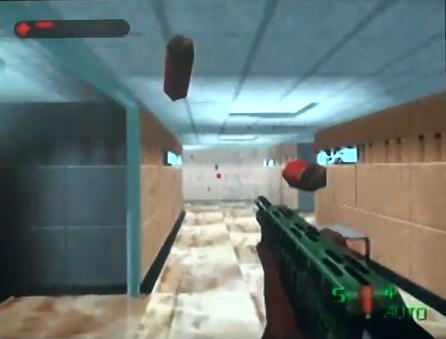
Image resolution: width=446 pixels, height=339 pixels. In order to click on seating in this screenshot , I will do `click(351, 234)`.